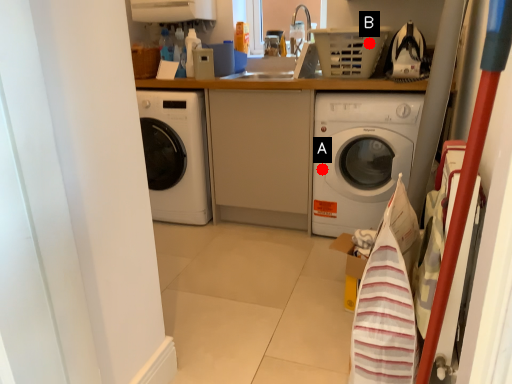
Question: Two points are circled on the image, labeled by A and B beside each circle. Which point is closer to the camera?

Choices:
 (A) A is closer
 (B) B is closer

Answer: (B)